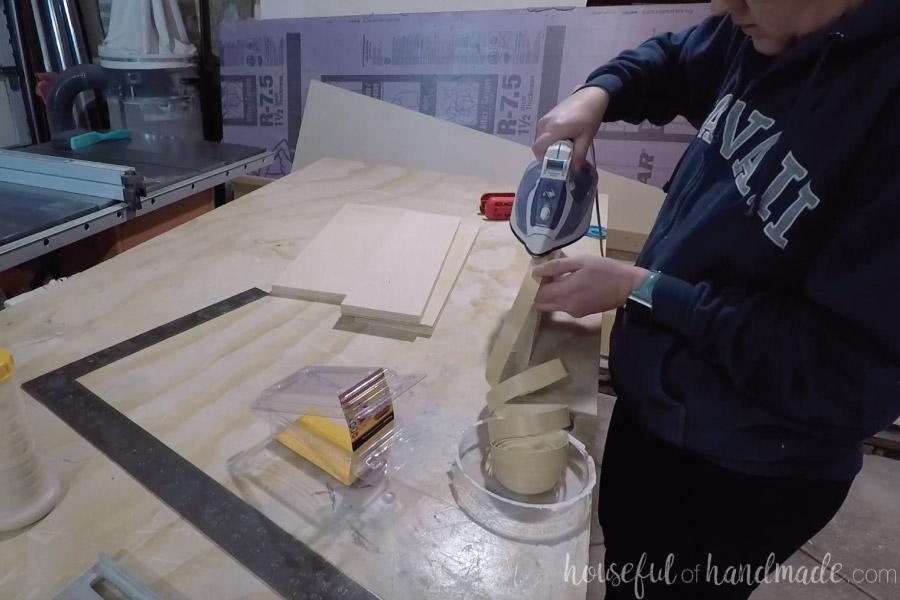
Find the location of `work table`. work table is located at coordinates (356, 477).